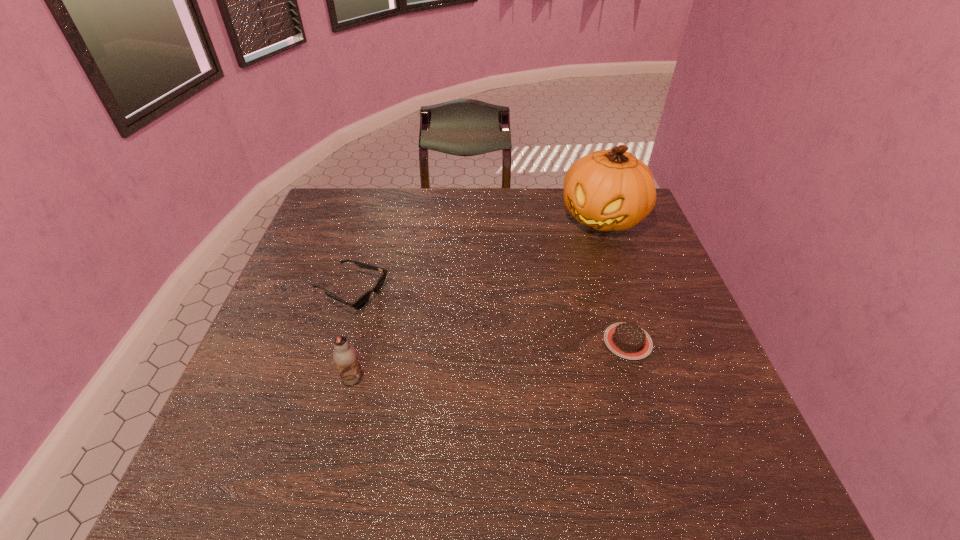
Identify the location of vacant space located 0.310m on the front-facing side of the sunglasses. (490, 347).

I want to click on free spot located 0.160m on the front-facing side of the sunglasses, so click(434, 325).

The height and width of the screenshot is (540, 960). I want to click on vacant space situated 0.170m on the front-facing side of the sunglasses, so click(x=438, y=326).

Identify the location of vacant space located on the front face of the pumpkin. Image resolution: width=960 pixels, height=540 pixels. (574, 259).

Find the location of a particular element. The image size is (960, 540). free point located 0.340m on the front face of the pumpkin is located at coordinates (537, 312).

Locate an element on the screen. vacant position located on the front face of the pumpkin is located at coordinates (539, 309).

Where is `object situated at the far edge`? The height and width of the screenshot is (540, 960). object situated at the far edge is located at coordinates (611, 189).

This screenshot has width=960, height=540. Find the location of `object that is at the left edge`. object that is at the left edge is located at coordinates (360, 302).

The width and height of the screenshot is (960, 540). I want to click on chocolate cake that is at the right edge, so click(x=627, y=340).

Where is `pumpkin at the right edge`? This screenshot has width=960, height=540. pumpkin at the right edge is located at coordinates (611, 189).